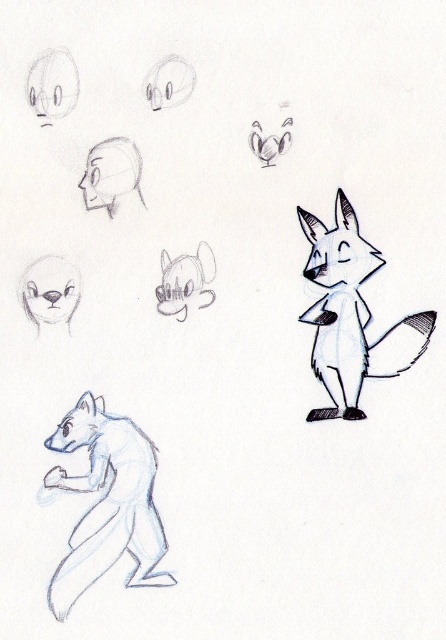
You are an animator standing 5 feet away from the drawing. You need to adjust the white fur fox at lower left to be closer to the camera. How much closer should you move it?

The white fur fox at lower left is currently 4.06 feet from the camera. To move it closer so you are 5 feet away, you need to bring it forward by 0.94 feet.